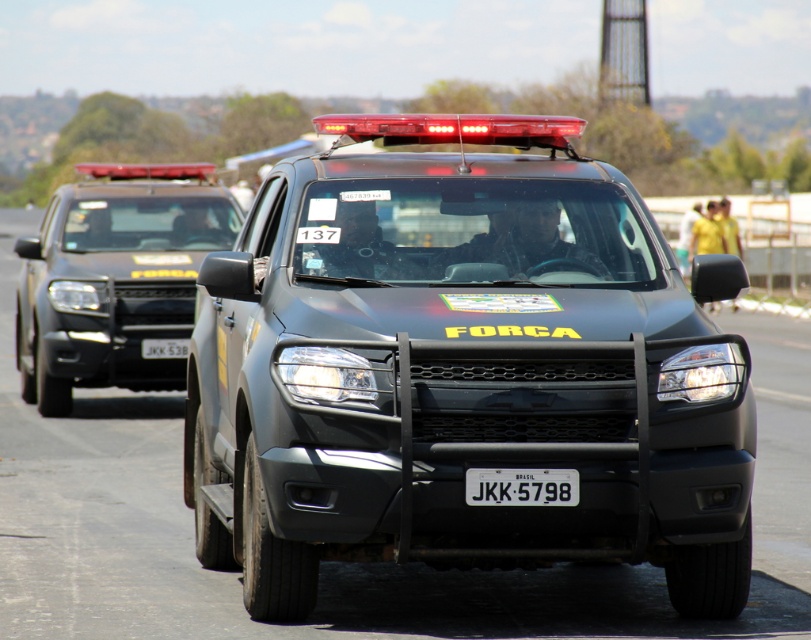
Is black plastic license plate at center in front of white plastic license plate at center?

That is True.

Is point (485, 497) positioned after point (166, 344)?

No, (485, 497) is closer to viewer.

Which is in front, point (505, 499) or point (174, 346)?

Point (505, 499) is more forward.

Locate an element on the screen. black plastic license plate at center is located at coordinates (521, 486).

Does matte black suv at left have a larger size compared to black plastic license plate at center?

Indeed, matte black suv at left has a larger size compared to black plastic license plate at center.

Between matte black suv at left and black plastic license plate at center, which one is positioned higher?

Positioned higher is matte black suv at left.

Is point (123, 227) more distant than point (561, 492)?

Yes, it is behind point (561, 492).

Identify the location of matte black suv at left. (114, 276).

Looking at this image, is matte black truck at center to the right of white plastic license plate at center from the viewer's perspective?

Indeed, matte black truck at center is positioned on the right side of white plastic license plate at center.

Does matte black truck at center have a smaller size compared to white plastic license plate at center?

No, matte black truck at center is not smaller than white plastic license plate at center.

Between point (412, 244) and point (170, 342), which one is positioned behind?

The point (170, 342) is more distant.

In order to click on matte black truck at center in this screenshot , I will do `click(462, 371)`.